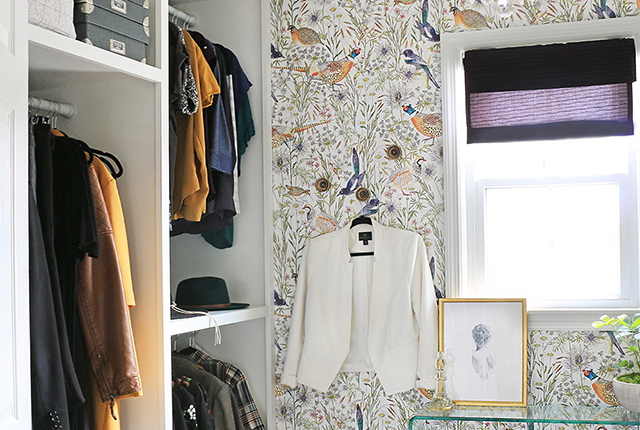
In order to click on white shelf in this screenshot , I will do `click(54, 45)`.